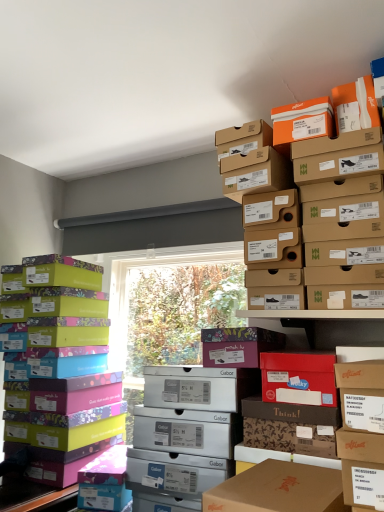
Question: From a real-world perspective, is matte purple shoebox at center on cardboard shoebox at upper center?

Choices:
 (A) no
 (B) yes

Answer: (A)

Question: Does matte purple shoebox at center have a lesser height compared to cardboard shoebox at upper center?

Choices:
 (A) no
 (B) yes

Answer: (B)

Question: Can you confirm if matte purple shoebox at center is thinner than cardboard shoebox at upper center?

Choices:
 (A) no
 (B) yes

Answer: (B)

Question: From the image's perspective, is matte purple shoebox at center below cardboard shoebox at upper center?

Choices:
 (A) yes
 (B) no

Answer: (A)

Question: Is matte purple shoebox at center positioned with its back to cardboard shoebox at upper center?

Choices:
 (A) yes
 (B) no

Answer: (B)

Question: Is cardboard shoebox at upper center surrounded by matte purple shoebox at center?

Choices:
 (A) yes
 (B) no

Answer: (B)

Question: Would you say cardboard shoebox at upper center is a long distance from matte purple shoebox at center?

Choices:
 (A) yes
 (B) no

Answer: (B)

Question: Is the depth of cardboard shoebox at upper center greater than that of matte purple shoebox at center?

Choices:
 (A) no
 (B) yes

Answer: (A)

Question: Is cardboard shoebox at upper center shorter than matte purple shoebox at center?

Choices:
 (A) no
 (B) yes

Answer: (A)

Question: From a real-world perspective, is cardboard shoebox at upper center located higher than matte purple shoebox at center?

Choices:
 (A) yes
 (B) no

Answer: (A)

Question: Is cardboard shoebox at upper center at the right side of matte purple shoebox at center?

Choices:
 (A) no
 (B) yes

Answer: (B)

Question: From the image's perspective, is cardboard shoebox at upper center below matte purple shoebox at center?

Choices:
 (A) yes
 (B) no

Answer: (B)

Question: From a real-world perspective, is multicolored cardboard shoebox at left below matte purple shoebox at center?

Choices:
 (A) yes
 (B) no

Answer: (A)